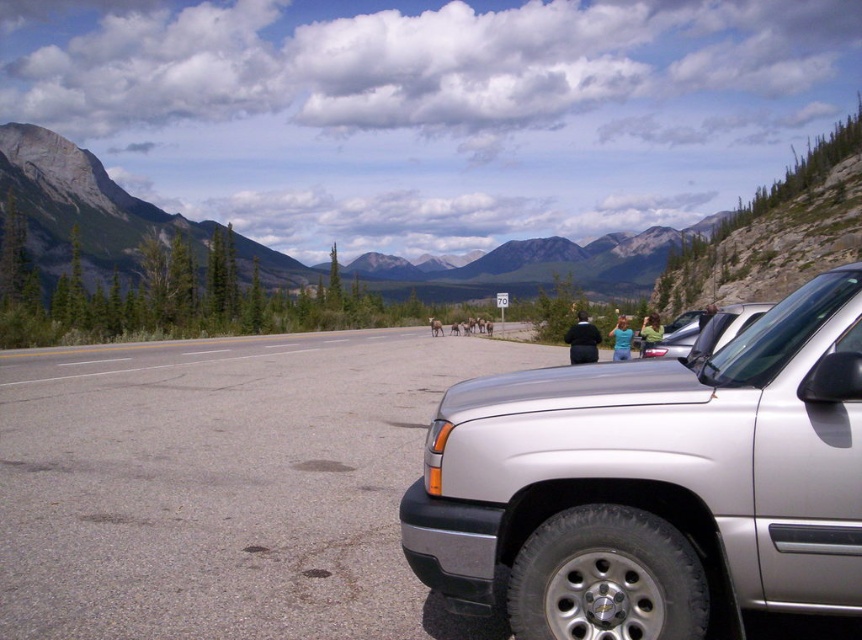
Between gray rock mountain at upper left and blue cotton shirt at center, which one is positioned higher?

gray rock mountain at upper left

Which is behind, point (261, 273) or point (619, 316)?

Positioned behind is point (261, 273).

Locate an element on the screen. The width and height of the screenshot is (862, 640). gray rock mountain at upper left is located at coordinates (80, 208).

Between satin silver suv at right and green fabric jacket at center, which one has less height?

Standing shorter between the two is satin silver suv at right.

Which is behind, point (748, 310) or point (646, 346)?

Point (646, 346)

Locate an element on the screen. This screenshot has height=640, width=862. satin silver suv at right is located at coordinates (722, 330).

What are the coordinates of `satin silver suv at right` in the screenshot? It's located at (722, 330).

Does silver metallic car at center have a larger size compared to green fabric jacket at center?

Yes, silver metallic car at center is bigger than green fabric jacket at center.

Between silver metallic car at center and green fabric jacket at center, which one is positioned higher?

Positioned higher is silver metallic car at center.

Between point (698, 323) and point (642, 348), which one is positioned behind?

The point (698, 323) is behind.

Locate an element on the screen. Image resolution: width=862 pixels, height=640 pixels. silver metallic car at center is located at coordinates (678, 336).